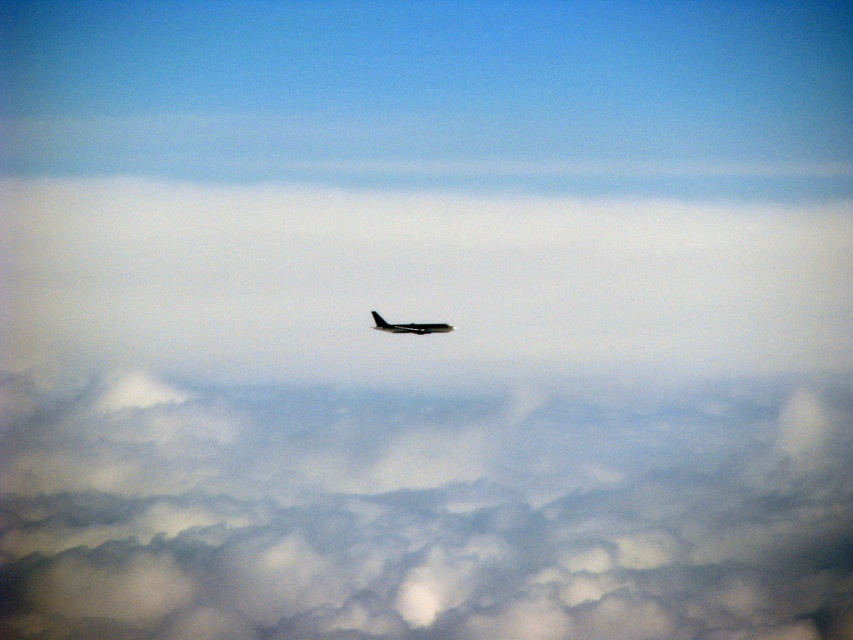
Who is taller, cloudy white at center or metallic airplane at center?

cloudy white at center is taller.

Is point (70, 520) more distant than point (409, 323)?

Yes.

Where is `cloudy white at center`? Image resolution: width=853 pixels, height=640 pixels. cloudy white at center is located at coordinates [421, 515].